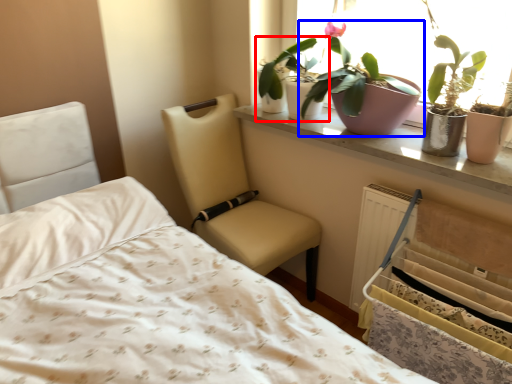
Question: Which point is further to the camera, houseplant (highlighted by a red box) or houseplant (highlighted by a blue box)?

Choices:
 (A) houseplant
 (B) houseplant

Answer: (A)